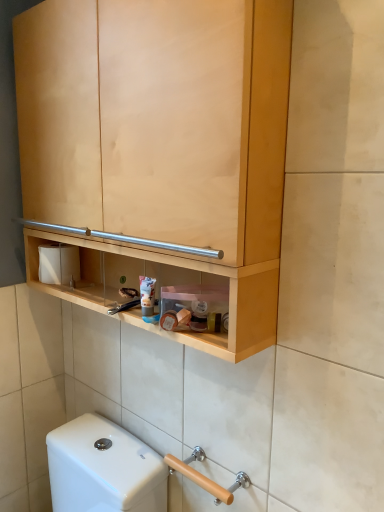
Locate an element on the screen. beige wood grab bar at lower right is located at coordinates (199, 479).

This screenshot has width=384, height=512. What do you see at coordinates (59, 264) in the screenshot?
I see `white matte toilet paper at left` at bounding box center [59, 264].

Find the location of a particular element. The image size is (384, 512). white matte toilet paper at left is located at coordinates (59, 264).

What do you see at coordinates (160, 143) in the screenshot? This screenshot has height=512, width=384. I see `natural wood cabinet at upper center` at bounding box center [160, 143].

What is the approximate height of natural wood cabinet at upper center?

The height of natural wood cabinet at upper center is 30.80 inches.

Locate an element on the screen. This screenshot has width=384, height=512. beige wood grab bar at lower right is located at coordinates (199, 479).

From the image's perspective, would you say matte plastic tube at center is positioned over white matte toilet paper at left?

No, from the image's perspective, matte plastic tube at center is not above white matte toilet paper at left.

Which object is further away from the camera, matte plastic tube at center or white matte toilet paper at left?

white matte toilet paper at left is behind.

Is white matte toilet paper at left at the back of matte plastic tube at center?

matte plastic tube at center does not have its back to white matte toilet paper at left.

Considering the positions of points (206, 482) and (39, 250), is point (206, 482) farther from camera compared to point (39, 250)?

No.

Consider the image. From a real-world perspective, is beige wood grab bar at lower right on white matte toilet paper at left?

No, from a real-world perspective, beige wood grab bar at lower right is not above white matte toilet paper at left.

Between beige wood grab bar at lower right and white matte toilet paper at left, which one appears on the left side from the viewer's perspective?

white matte toilet paper at left is more to the left.

Does beige wood grab bar at lower right turn towards matte plastic tube at center?

No, beige wood grab bar at lower right is not turned towards matte plastic tube at center.

From the image's perspective, which is above, beige wood grab bar at lower right or matte plastic tube at center?

matte plastic tube at center.

Based on the photo, is the depth of beige wood grab bar at lower right greater than that of natural wood cabinet at upper center?

Yes, beige wood grab bar at lower right is further from the viewer.

How different are the orientations of beige wood grab bar at lower right and natural wood cabinet at upper center in degrees?

The angular difference between beige wood grab bar at lower right and natural wood cabinet at upper center is 0.346 degrees.

In the image, there is a natural wood cabinet at upper center. Identify the location of door handle below it (from a real-world perspective). (199, 479).

Would you say beige wood grab bar at lower right is a long distance from natural wood cabinet at upper center?

No, beige wood grab bar at lower right is not far away from natural wood cabinet at upper center.

From a real-world perspective, is white matte toilet paper at left located beneath natural wood cabinet at upper center?

Yes, from a real-world perspective, white matte toilet paper at left is under natural wood cabinet at upper center.

Identify the location of toilet paper below the natural wood cabinet at upper center (from the image's perspective). The image size is (384, 512). (59, 264).

Is natural wood cabinet at upper center at the back of white matte toilet paper at left?

Correct, white matte toilet paper at left is looking away from natural wood cabinet at upper center.

Between white matte toilet paper at left and natural wood cabinet at upper center, which one appears on the right side from the viewer's perspective?

natural wood cabinet at upper center is more to the right.

Does point (135, 48) come farther from viewer compared to point (188, 469)?

No, it is not.

Can you tell me how much natural wood cabinet at upper center and beige wood grab bar at lower right differ in facing direction?

The angle between the facing direction of natural wood cabinet at upper center and the facing direction of beige wood grab bar at lower right is 0.346 degrees.

Does natural wood cabinet at upper center have a greater width compared to beige wood grab bar at lower right?

Indeed, natural wood cabinet at upper center has a greater width compared to beige wood grab bar at lower right.

Would you say natural wood cabinet at upper center contains beige wood grab bar at lower right?

Definitely not — beige wood grab bar at lower right is not inside natural wood cabinet at upper center.

Is point (150, 307) more distant than point (110, 154)?

Yes.

Considering the sizes of objects matte plastic tube at center and natural wood cabinet at upper center in the image provided, who is taller, matte plastic tube at center or natural wood cabinet at upper center?

natural wood cabinet at upper center.

Could you tell me if matte plastic tube at center is turned towards natural wood cabinet at upper center?

Yes, matte plastic tube at center is oriented towards natural wood cabinet at upper center.

Based on the photo, would you say natural wood cabinet at upper center is part of matte plastic tube at center's contents?

No, natural wood cabinet at upper center is located outside of matte plastic tube at center.

In the image, there is a white matte toilet paper at left. In order to click on toiletry below it (from the image's perspective) in this screenshot , I will do `click(147, 295)`.

This screenshot has height=512, width=384. I want to click on toilet paper behind the beige wood grab bar at lower right, so click(x=59, y=264).

When comparing their distances from beige wood grab bar at lower right, does natural wood cabinet at upper center or white matte toilet paper at left seem closer?

white matte toilet paper at left.

Looking at the image, which one is located further to white matte toilet paper at left, matte plastic tube at center or beige wood grab bar at lower right?

Among the two, beige wood grab bar at lower right is located further to white matte toilet paper at left.

Based on their spatial positions, is white matte toilet paper at left or matte plastic tube at center closer to natural wood cabinet at upper center?

matte plastic tube at center is positioned closer to the anchor natural wood cabinet at upper center.

Based on their spatial positions, is white matte toilet paper at left or matte plastic tube at center further from beige wood grab bar at lower right?

Based on the image, white matte toilet paper at left appears to be further to beige wood grab bar at lower right.

Consider the image. Based on their spatial positions, is natural wood cabinet at upper center or beige wood grab bar at lower right closer to matte plastic tube at center?

natural wood cabinet at upper center is positioned closer to the anchor matte plastic tube at center.

Based on their spatial positions, is beige wood grab bar at lower right or matte plastic tube at center closer to white matte toilet paper at left?

Based on the image, matte plastic tube at center appears to be nearer to white matte toilet paper at left.

Based on their spatial positions, is natural wood cabinet at upper center or matte plastic tube at center further from white matte toilet paper at left?

natural wood cabinet at upper center lies further to white matte toilet paper at left than the other object.

Looking at the image, which one is located closer to white matte toilet paper at left, matte plastic tube at center or natural wood cabinet at upper center?

matte plastic tube at center is closer to white matte toilet paper at left.

At what (x,y) coordinates should I click in order to perform the action: click on toilet paper between natural wood cabinet at upper center and beige wood grab bar at lower right in the up-down direction. Please return your answer as a coordinate pair (x, y). Looking at the image, I should click on (59, 264).

In order to click on toiletry between natural wood cabinet at upper center and beige wood grab bar at lower right from top to bottom in this screenshot , I will do `click(147, 295)`.

Image resolution: width=384 pixels, height=512 pixels. In order to click on toiletry between natural wood cabinet at upper center and white matte toilet paper at left from front to back in this screenshot , I will do click(147, 295).

Identify the location of toiletry between white matte toilet paper at left and beige wood grab bar at lower right from top to bottom. This screenshot has height=512, width=384. (147, 295).